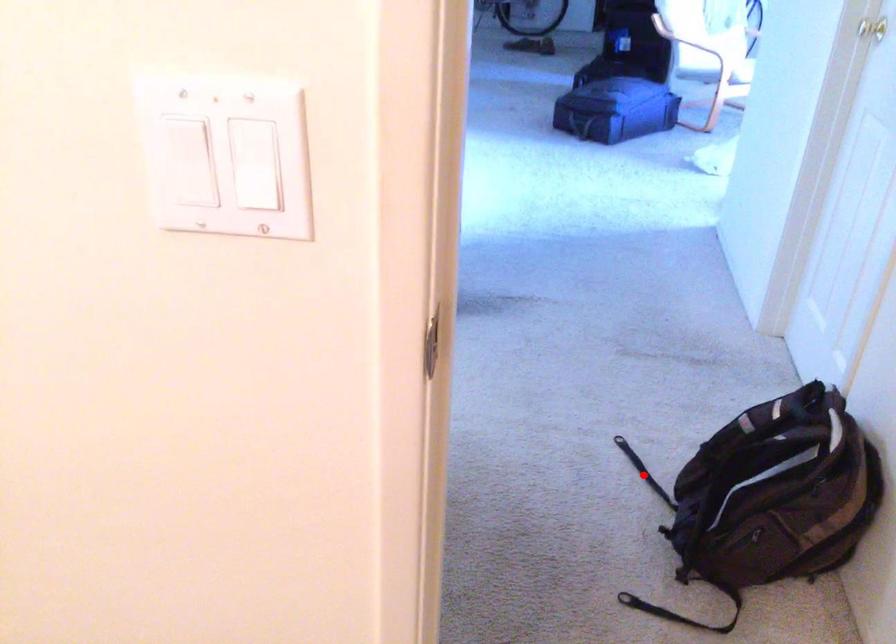
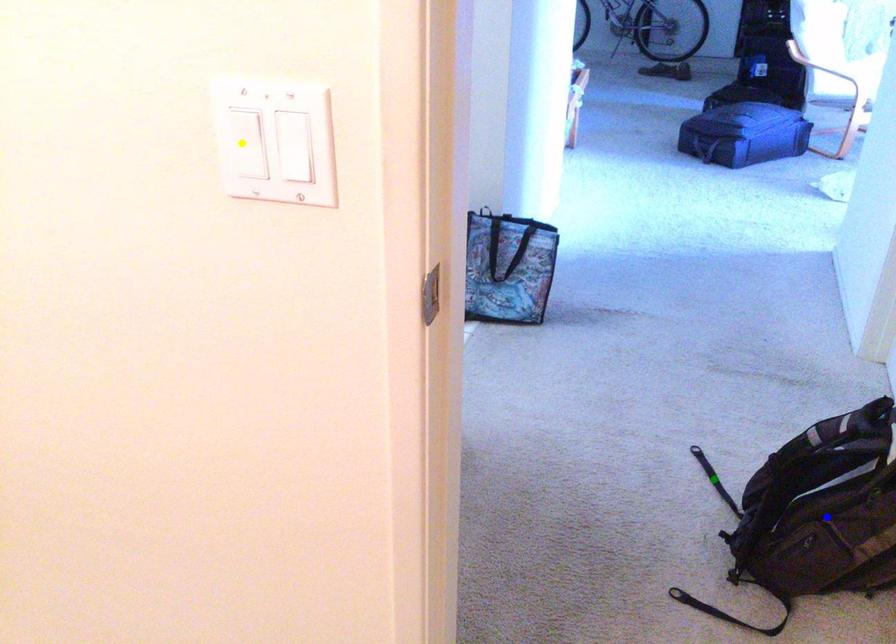
Question: I am providing you with two images of the same scene from different viewpoints. A red point is marked on the first image. You are given multiple points on the second image. In image 2, which mark is for the same physical point as the one in image 1?

Choices:
 (A) yellow point
 (B) blue point
 (C) green point

Answer: (C)